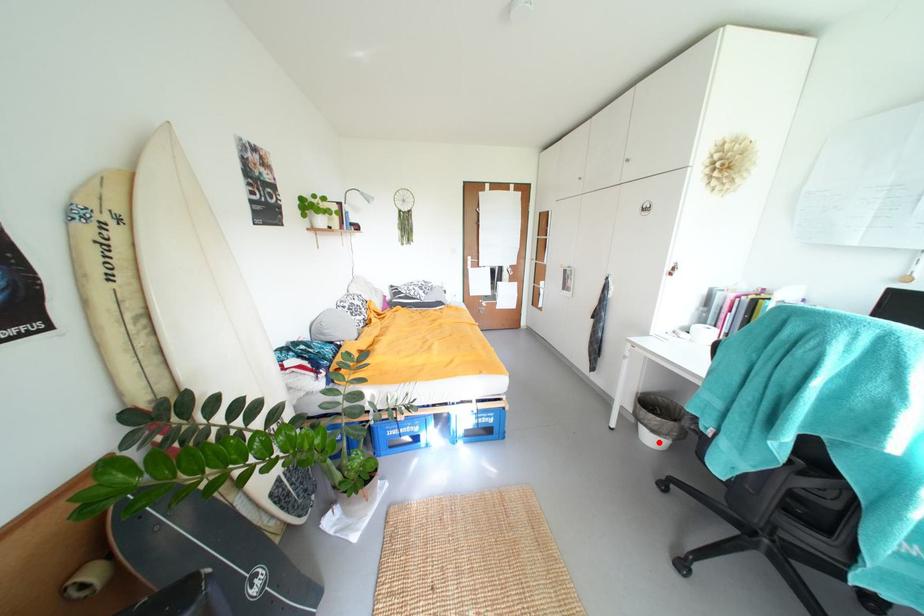
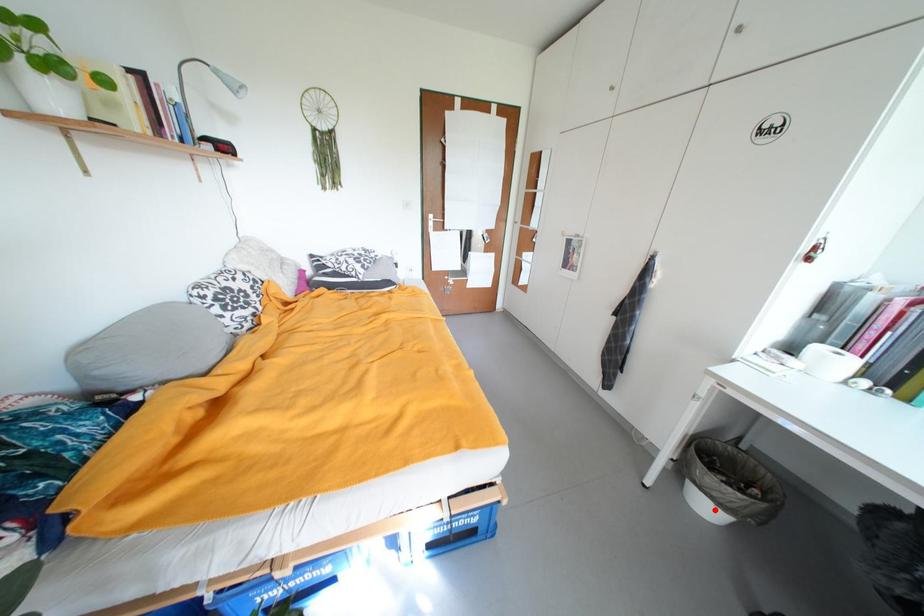
I am providing you with two images of the same scene from different viewpoints. A red point is marked on the first image and another point is marked on the second image. Is the red point in image1 aligned with the point shown in image2?

Yes